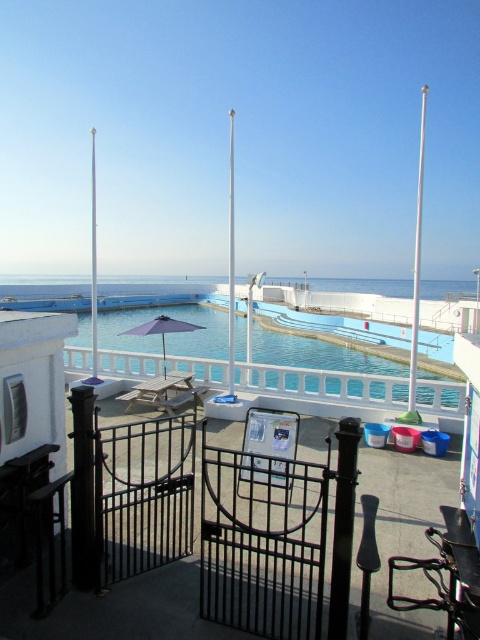
Question: Is blue glass water at center to the right of white metallic pole at upper center from the viewer's perspective?

Choices:
 (A) no
 (B) yes

Answer: (A)

Question: Which object is positioned closest to the white glossy pole at upper center?

Choices:
 (A) blue glass water at center
 (B) wooden chair at center

Answer: (B)

Question: Which object is the closest to the wooden chair at center?

Choices:
 (A) purple fabric umbrella at center
 (B) white glossy pole at upper center
 (C) white glossy pole at center
 (D) white metallic pole at upper center

Answer: (A)

Question: Which point is closer to the camera?

Choices:
 (A) blue glass water at center
 (B) white glossy pole at upper center
 (C) white glossy pole at center
 (D) white metallic pole at upper center

Answer: (A)

Question: Can you confirm if white glossy pole at center is positioned to the left of purple fabric umbrella at center?

Choices:
 (A) no
 (B) yes

Answer: (B)

Question: Does white glossy pole at center appear over purple fabric umbrella at center?

Choices:
 (A) no
 (B) yes

Answer: (B)